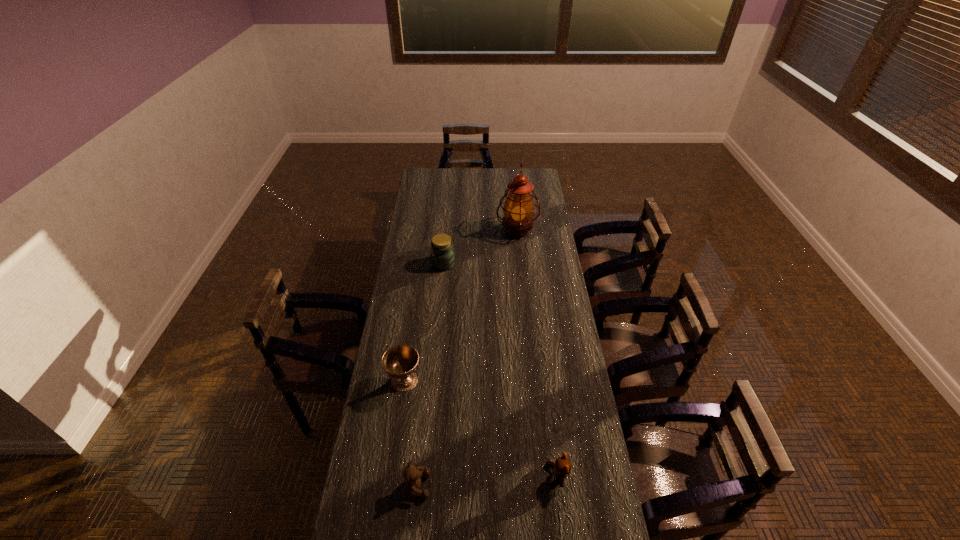
Where is `free region that satisfies the following two spatial constraints: 1. on the back side of the third farthest object; 2. on the right side of the tallest object`? The width and height of the screenshot is (960, 540). free region that satisfies the following two spatial constraints: 1. on the back side of the third farthest object; 2. on the right side of the tallest object is located at coordinates (426, 231).